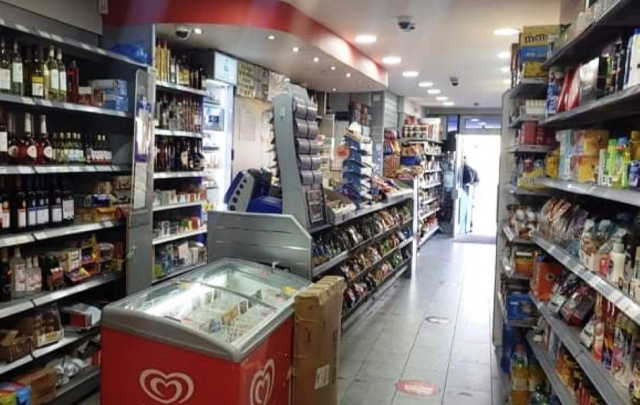
This screenshot has height=405, width=640. I want to click on floor distance stickers, so click(438, 318), click(422, 387).